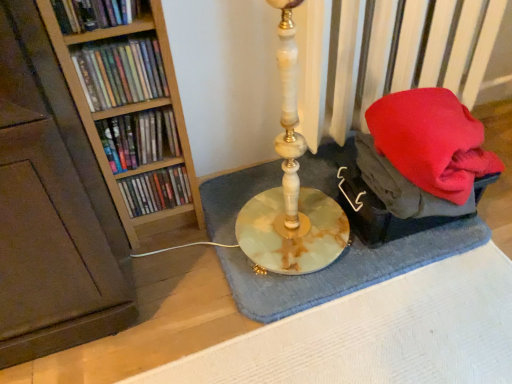
Question: Can you confirm if blue textured bath mat at center is smaller than matte plastic books at left, which is the 2th book from top to bottom?

Choices:
 (A) yes
 (B) no

Answer: (B)

Question: Is blue textured bath mat at center located outside matte plastic books at left, which is the 2th book from top to bottom?

Choices:
 (A) no
 (B) yes

Answer: (B)

Question: From a real-world perspective, is blue textured bath mat at center physically above matte plastic books at left, which is the 2th book from top to bottom?

Choices:
 (A) yes
 (B) no

Answer: (B)

Question: Can you confirm if blue textured bath mat at center is wider than matte plastic books at left, which is the 2th book from top to bottom?

Choices:
 (A) no
 (B) yes

Answer: (B)

Question: Is blue textured bath mat at center in contact with matte plastic books at left, which is the 2th book from top to bottom?

Choices:
 (A) yes
 (B) no

Answer: (B)

Question: Is blue textured bath mat at center positioned behind matte plastic books at left, which is the 2th book from top to bottom?

Choices:
 (A) no
 (B) yes

Answer: (B)

Question: Is matte plastic books at left, positioned as the 3th book in top-to-bottom order, inside blue textured bath mat at center?

Choices:
 (A) no
 (B) yes

Answer: (A)

Question: Does blue textured bath mat at center have a smaller size compared to matte plastic books at left, which is the second book from bottom to top?

Choices:
 (A) no
 (B) yes

Answer: (A)

Question: Is blue textured bath mat at center outside of matte plastic books at left, positioned as the 3th book in top-to-bottom order?

Choices:
 (A) yes
 (B) no

Answer: (A)

Question: Considering the relative sizes of blue textured bath mat at center and matte plastic books at left, positioned as the 3th book in top-to-bottom order, in the image provided, is blue textured bath mat at center shorter than matte plastic books at left, positioned as the 3th book in top-to-bottom order,?

Choices:
 (A) no
 (B) yes

Answer: (B)

Question: Considering the relative sizes of blue textured bath mat at center and matte plastic books at left, positioned as the 3th book in top-to-bottom order, in the image provided, is blue textured bath mat at center bigger than matte plastic books at left, positioned as the 3th book in top-to-bottom order,?

Choices:
 (A) no
 (B) yes

Answer: (B)

Question: Is blue textured bath mat at center facing towards matte plastic books at left, positioned as the 3th book in top-to-bottom order?

Choices:
 (A) yes
 (B) no

Answer: (B)

Question: Considering the relative sizes of matte plastic books at left, positioned as the first book in bottom-to-top order, and matte plastic books at left, positioned as the 3th book in top-to-bottom order, in the image provided, is matte plastic books at left, positioned as the first book in bottom-to-top order, thinner than matte plastic books at left, positioned as the 3th book in top-to-bottom order,?

Choices:
 (A) yes
 (B) no

Answer: (B)